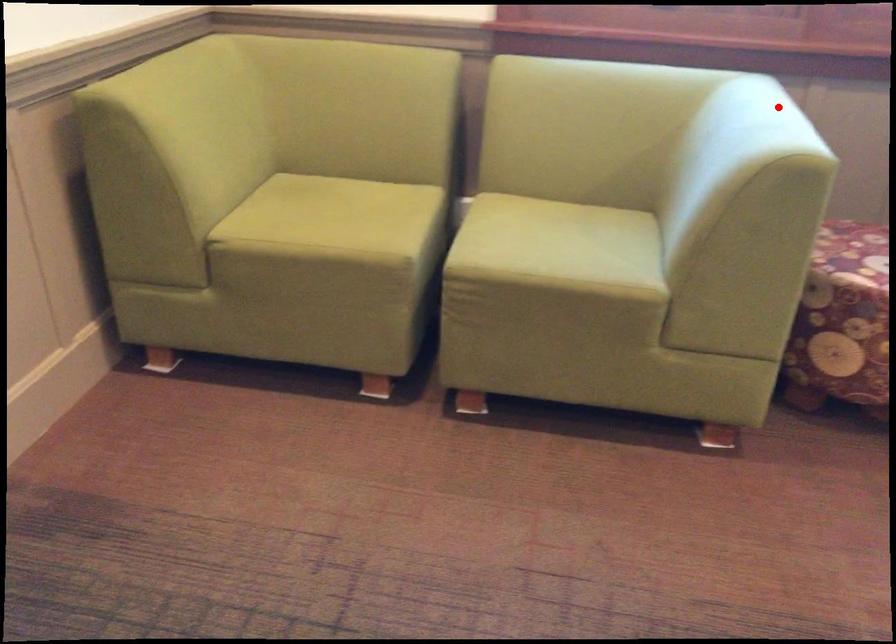
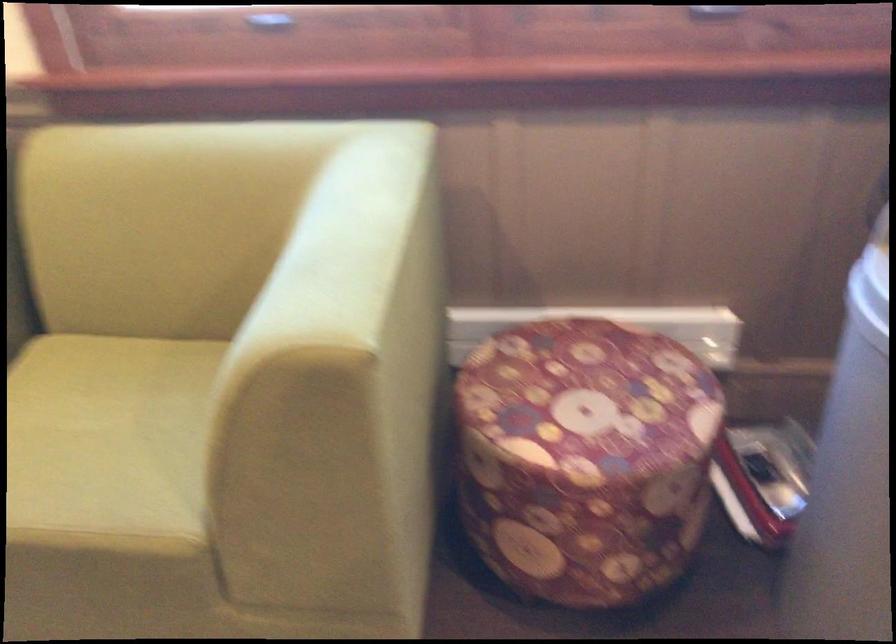
Question: I am providing you with two images of the same scene from different viewpoints. A red point is shown in image1. For the corresponding object point in image2, is it positioned nearer or farther from the camera?

Choices:
 (A) Nearer
 (B) Farther

Answer: (A)